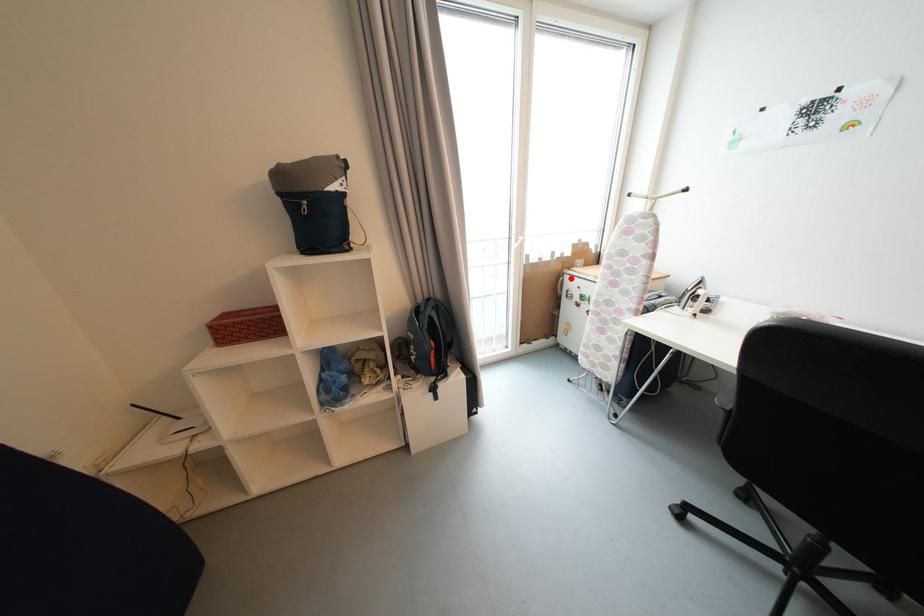
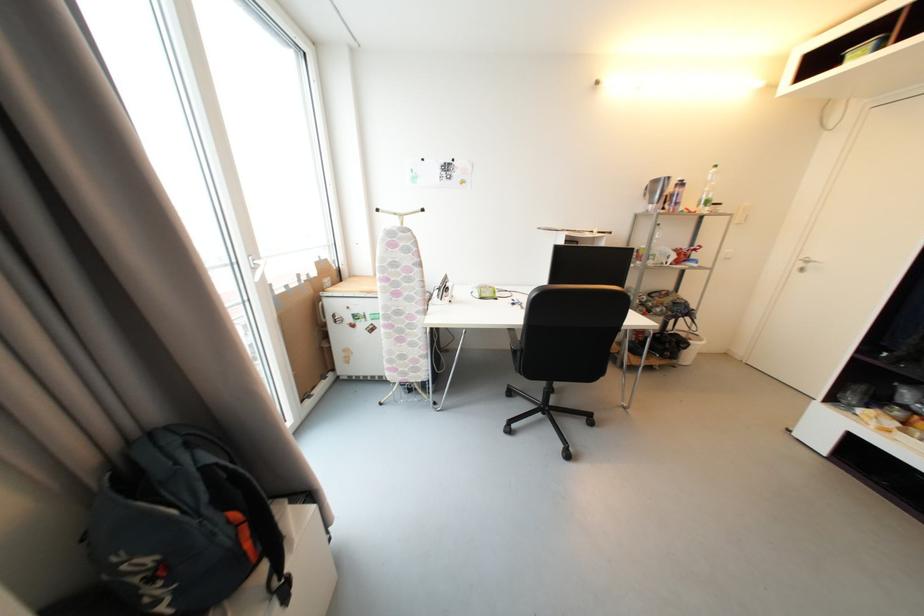
Locate, in the second image, the point that corresponds to the highlighted location in the first image.

(330, 302)